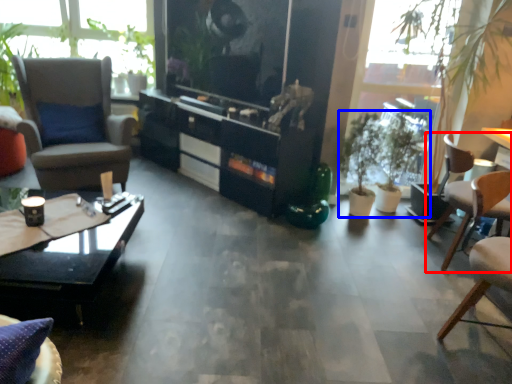
Question: Which object is further to the camera taking this photo, chair (highlighted by a red box) or houseplant (highlighted by a blue box)?

Choices:
 (A) chair
 (B) houseplant

Answer: (B)